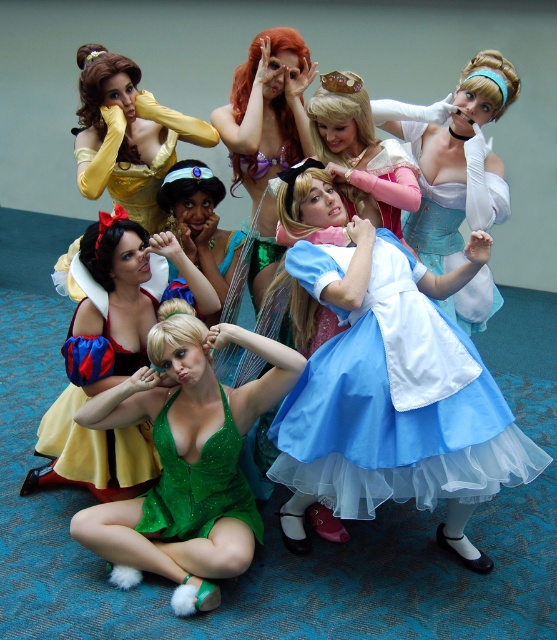
You are a photographer at a costume event and need to position the green sequined dress at center and the green satin dress at lower center for a photo. Which of the two dresses should be placed closer to the front to ensure both are visible in the frame?

The green sequined dress at center should be placed closer to the front since it has a lesser height compared to the green satin dress at lower center, allowing both to be visible in the frame.